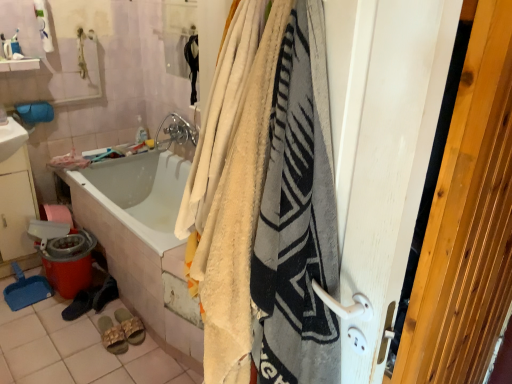
Question: From the image's perspective, is soft cotton blanket at center under black fabric shoe at lower left, the 1th footwear from the left?

Choices:
 (A) no
 (B) yes

Answer: (A)

Question: Is soft cotton blanket at center taller than black fabric shoe at lower left, positioned as the fourth footwear in right-to-left order?

Choices:
 (A) no
 (B) yes

Answer: (B)

Question: Considering the relative positions of soft cotton blanket at center and black fabric shoe at lower left, positioned as the fourth footwear in right-to-left order, in the image provided, is soft cotton blanket at center to the right of black fabric shoe at lower left, positioned as the fourth footwear in right-to-left order, from the viewer's perspective?

Choices:
 (A) yes
 (B) no

Answer: (A)

Question: From a real-world perspective, is soft cotton blanket at center physically below black fabric shoe at lower left, positioned as the fourth footwear in right-to-left order?

Choices:
 (A) no
 (B) yes

Answer: (A)

Question: From the image's perspective, is soft cotton blanket at center on black fabric shoe at lower left, the 1th footwear from the left?

Choices:
 (A) yes
 (B) no

Answer: (A)

Question: Considering the relative sizes of soft cotton blanket at center and black fabric shoe at lower left, positioned as the fourth footwear in right-to-left order, in the image provided, is soft cotton blanket at center bigger than black fabric shoe at lower left, positioned as the fourth footwear in right-to-left order,?

Choices:
 (A) yes
 (B) no

Answer: (A)

Question: Does white glossy sink at upper left, marked as the 1th sink in a top-to-bottom arrangement, lie in front of white tile at lower left?

Choices:
 (A) no
 (B) yes

Answer: (A)

Question: Is white tile at lower left surrounded by white glossy sink at upper left, marked as the 1th sink in a top-to-bottom arrangement?

Choices:
 (A) yes
 (B) no

Answer: (B)

Question: Can you see white glossy sink at upper left, which is the 2th sink from bottom to top, touching white tile at lower left?

Choices:
 (A) yes
 (B) no

Answer: (B)

Question: Would you say white glossy sink at upper left, marked as the 1th sink in a top-to-bottom arrangement, is outside white tile at lower left?

Choices:
 (A) no
 (B) yes

Answer: (B)

Question: From a real-world perspective, is white glossy sink at upper left, which is the 2th sink from bottom to top, located beneath white tile at lower left?

Choices:
 (A) no
 (B) yes

Answer: (A)

Question: From the image's perspective, would you say white glossy sink at upper left, which is the 2th sink from bottom to top, is positioned over white tile at lower left?

Choices:
 (A) yes
 (B) no

Answer: (A)

Question: Is black suede shoes at lower left, which ranks as the 2th footwear in left-to-right order, facing towards chrome metallic faucet at upper center?

Choices:
 (A) yes
 (B) no

Answer: (B)